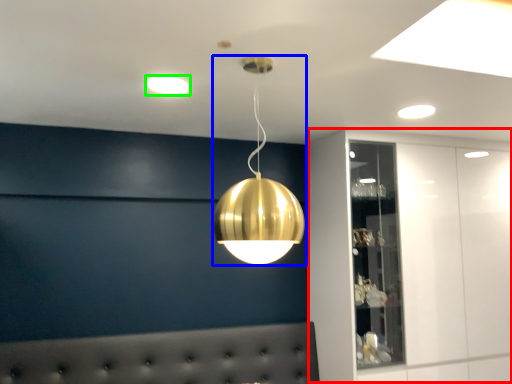
Question: Considering the real-world distances, which object is farthest from dresser (highlighted by a red box)? lamp (highlighted by a blue box) or lamp (highlighted by a green box)?

Choices:
 (A) lamp
 (B) lamp

Answer: (B)